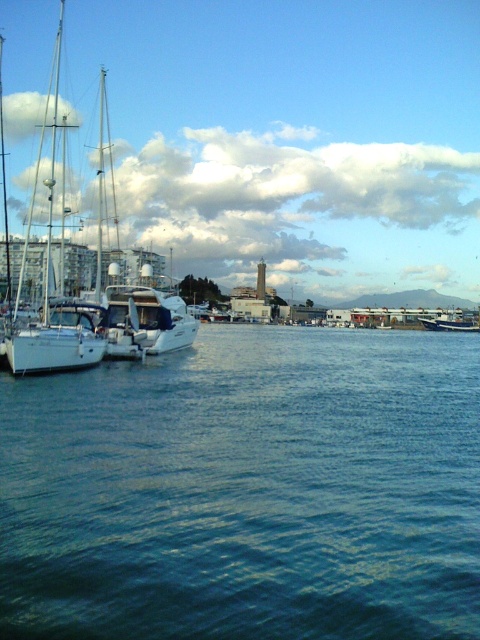
Is blue water at center taller than blue glossy boat at right?

In fact, blue water at center may be shorter than blue glossy boat at right.

Does blue water at center have a lesser height compared to blue glossy boat at right?

Yes, blue water at center is shorter than blue glossy boat at right.

The height and width of the screenshot is (640, 480). Describe the element at coordinates (247, 490) in the screenshot. I see `blue water at center` at that location.

You are a GUI agent. You are given a task and a screenshot of the screen. Output one action in this format:
    pyautogui.click(x=<x>, y=<y>)
    Task: Click on the blue water at center
    
    Given the screenshot: What is the action you would take?
    pyautogui.click(x=247, y=490)

Does point (386, 563) lie in front of point (97, 244)?

Yes.

Can you confirm if blue water at center is taller than white glossy sailboat at left?

Incorrect, blue water at center's height is not larger of white glossy sailboat at left's.

At what (x,y) coordinates should I click in order to perform the action: click on blue water at center. Please return your answer as a coordinate pair (x, y). Image resolution: width=480 pixels, height=640 pixels. Looking at the image, I should click on (247, 490).

Who is lower down, white glossy sailboat at left or blue glossy boat at right?

blue glossy boat at right is lower down.

Can you confirm if white glossy sailboat at left is thinner than blue glossy boat at right?

No.

Who is more distant from viewer, [72,368] or [460,326]?

The point [460,326] is more distant.

At what (x,y) coordinates should I click in order to perform the action: click on white glossy sailboat at left. Please return your answer as a coordinate pair (x, y). The image size is (480, 640). Looking at the image, I should click on (95, 308).